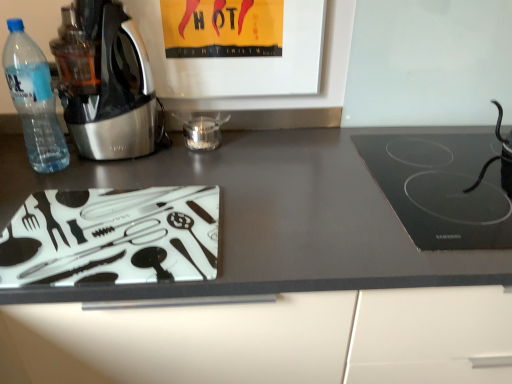
Where is `vacant area to the right of metallic stainless steel kettle at left`? The height and width of the screenshot is (384, 512). vacant area to the right of metallic stainless steel kettle at left is located at coordinates [x=202, y=158].